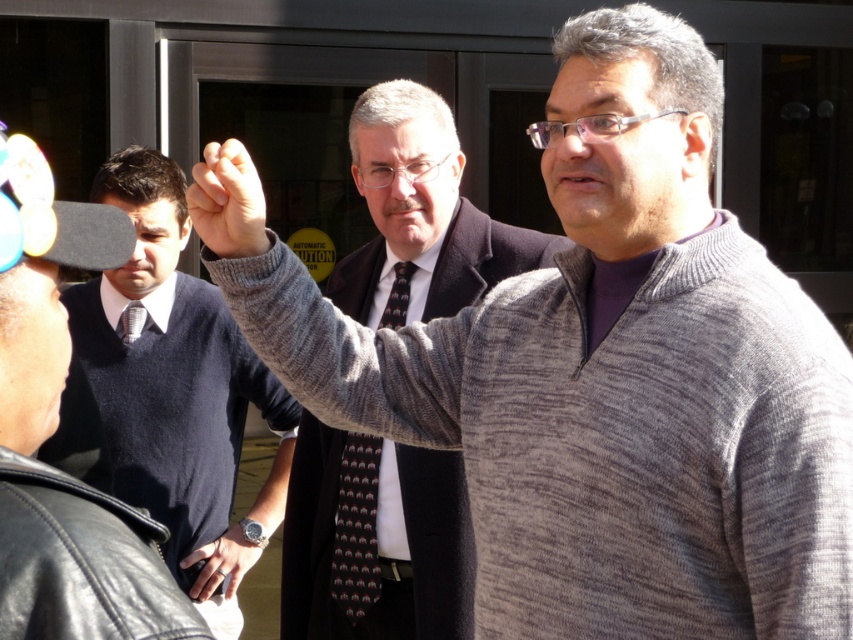
You are a fashion designer observing the scene. You notice the dark gray textured tie at center and the black leather watch at center. Which accessory is positioned to the right of the other?

The dark gray textured tie at center is to the right of black leather watch at center.

You are standing in front of the group and want to determine which of the two points, point (355, 269) or point (202, 579), is closer to you. Based on the spatial arrangement, which point is nearer?

Point (355, 269) is closer to the viewer than point (202, 579).

You are a photographer trying to capture a closeup of the black leather watch at center without including the knit gray sweater at center in the frame. Given their sizes, is this possible?

The knit gray sweater at center is bigger than the black leather watch at center. Since the sweater is larger, it might block the watch if positioned between them, making it challenging to frame the watch alone without the sweater appearing in the shot.